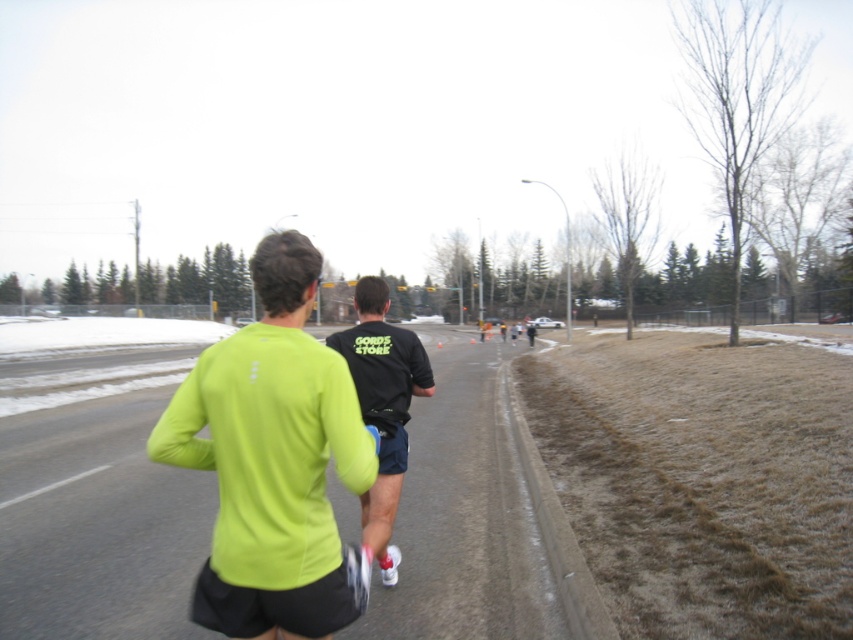
Which is above, neon green fabric shirt at center or black matte t-shirt at center?

black matte t-shirt at center

The width and height of the screenshot is (853, 640). In order to click on neon green fabric shirt at center in this screenshot , I will do `click(271, 460)`.

You are a GUI agent. You are given a task and a screenshot of the screen. Output one action in this format:
    pyautogui.click(x=<x>, y=<y>)
    Task: Click on the neon green fabric shirt at center
    
    Given the screenshot: What is the action you would take?
    pyautogui.click(x=271, y=460)